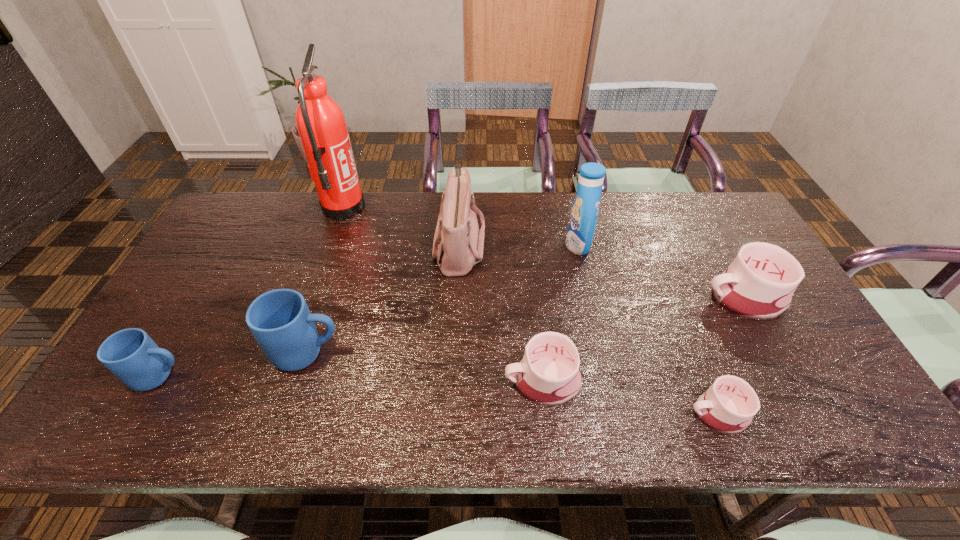
Locate an element on the screen. The height and width of the screenshot is (540, 960). object that is the third closest one to the left blue mug is located at coordinates (458, 244).

Locate an element on the screen. the second closest mug to the third mug from left to right is located at coordinates (280, 320).

Identify which mug is located as the nearest to the third mug from right to left. Please provide its 2D coordinates. Your answer should be formatted as a tuple, i.e. [(x, y)], where the tuple contains the x and y coordinates of a point satisfying the conditions above.

[(728, 406)]

Identify which white mug is the nearest to the second smallest white mug. Please provide its 2D coordinates. Your answer should be formatted as a tuple, i.e. [(x, y)], where the tuple contains the x and y coordinates of a point satisfying the conditions above.

[(728, 406)]

Locate an element on the screen. The width and height of the screenshot is (960, 540). white mug that stands as the closest to the second shortest mug is located at coordinates (728, 406).